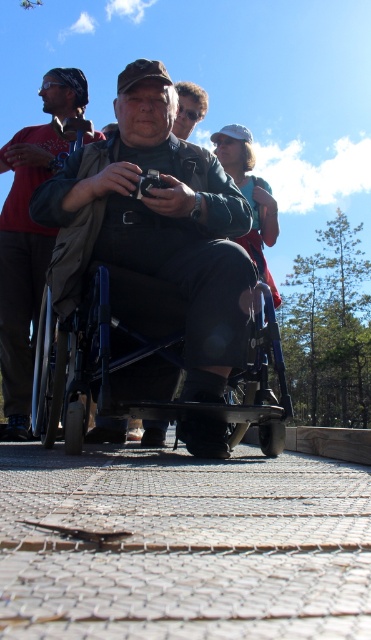
Question: Which of the following is the farthest from the observer?

Choices:
 (A) brown leather jacket at upper left
 (B) metallic blue wheelchair at center

Answer: (A)

Question: Can you confirm if matte black wheelchair at center is smaller than metallic blue wheelchair at center?

Choices:
 (A) no
 (B) yes

Answer: (B)

Question: Which point is farther to the camera?

Choices:
 (A) (198, 244)
 (B) (94, 353)

Answer: (A)

Question: Which point is closer to the camera?

Choices:
 (A) brown leather jacket at upper left
 (B) metallic blue wheelchair at center

Answer: (B)

Question: Can you confirm if matte black wheelchair at center is positioned below metallic blue wheelchair at center?

Choices:
 (A) no
 (B) yes

Answer: (A)

Question: Is metallic blue wheelchair at center above brown leather jacket at upper left?

Choices:
 (A) no
 (B) yes

Answer: (A)